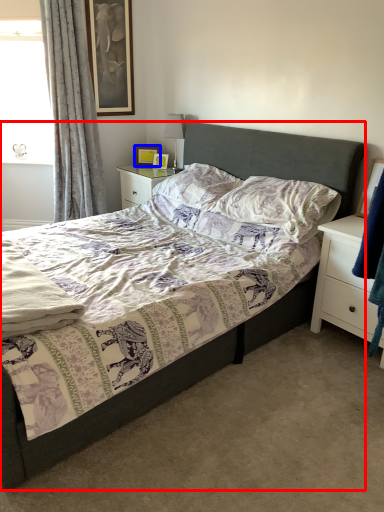
Question: Which object appears farthest to the camera in this image, bed (highlighted by a red box) or picture frame (highlighted by a blue box)?

Choices:
 (A) bed
 (B) picture frame

Answer: (B)